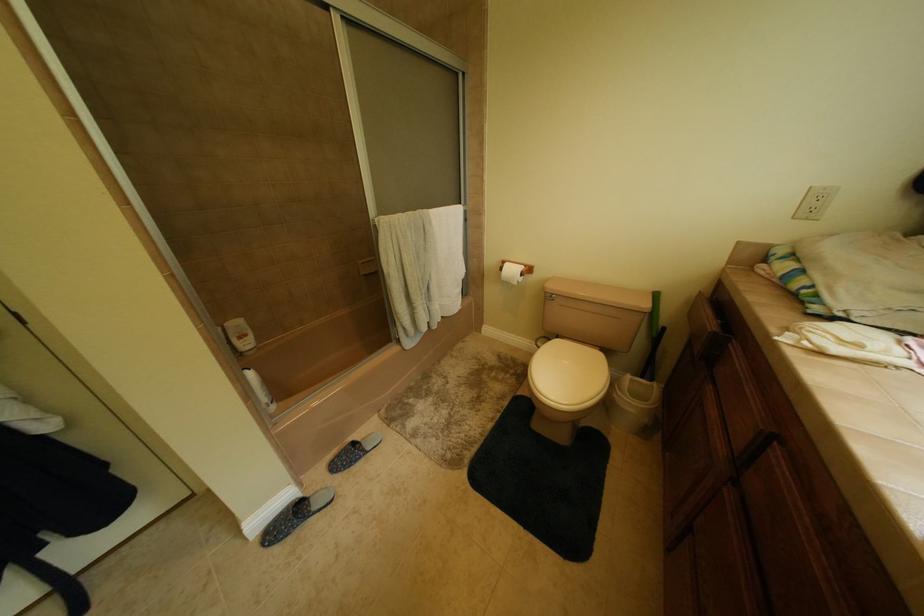
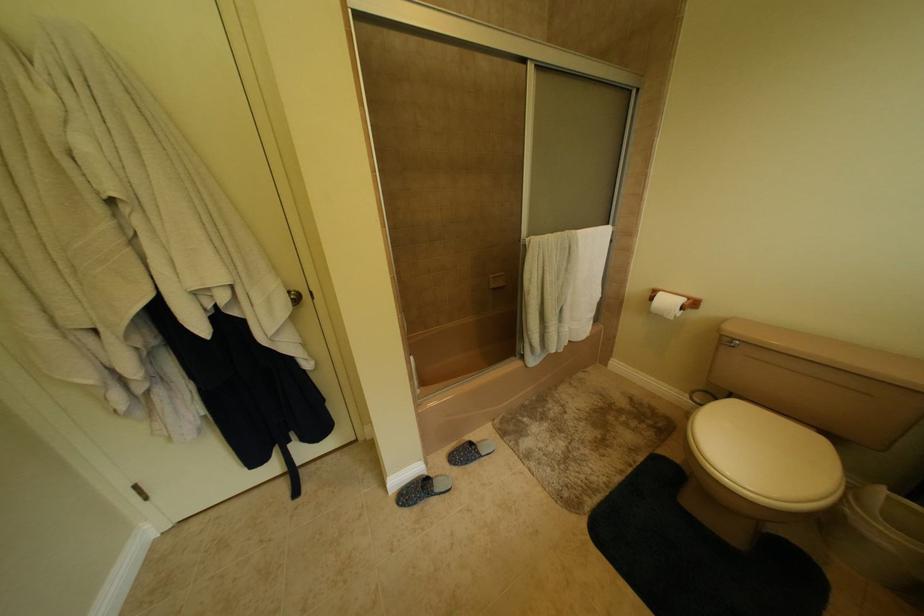
Question: The camera is either moving clockwise (left) or counter-clockwise (right) around the object. The first image is from the beginning of the video and the second image is from the end. Is the camera moving left or right when shooting the video?

Choices:
 (A) Left
 (B) Right

Answer: (B)